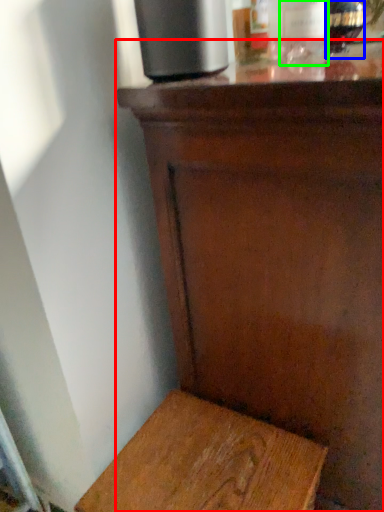
Question: Considering the real-world distances, which object is farthest from table (highlighted by a red box)? bottle (highlighted by a blue box) or bottle (highlighted by a green box)?

Choices:
 (A) bottle
 (B) bottle

Answer: (A)